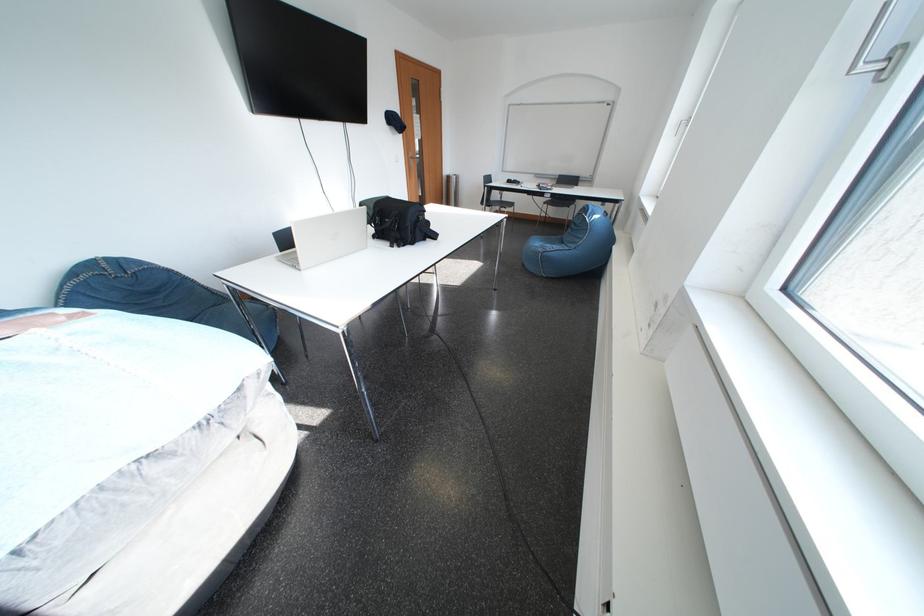
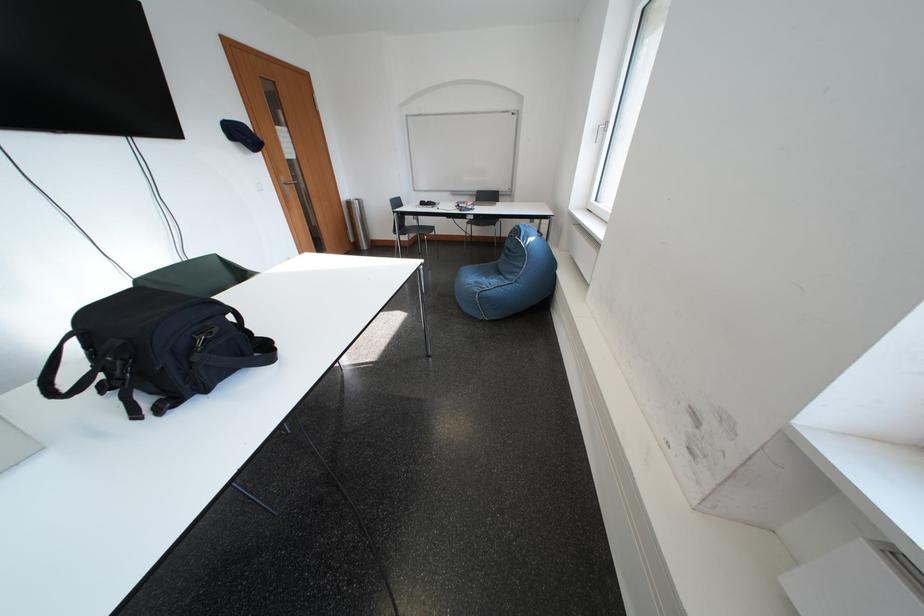
In the second image, find the point that corresponds to point 563,180 in the first image.

(480, 198)